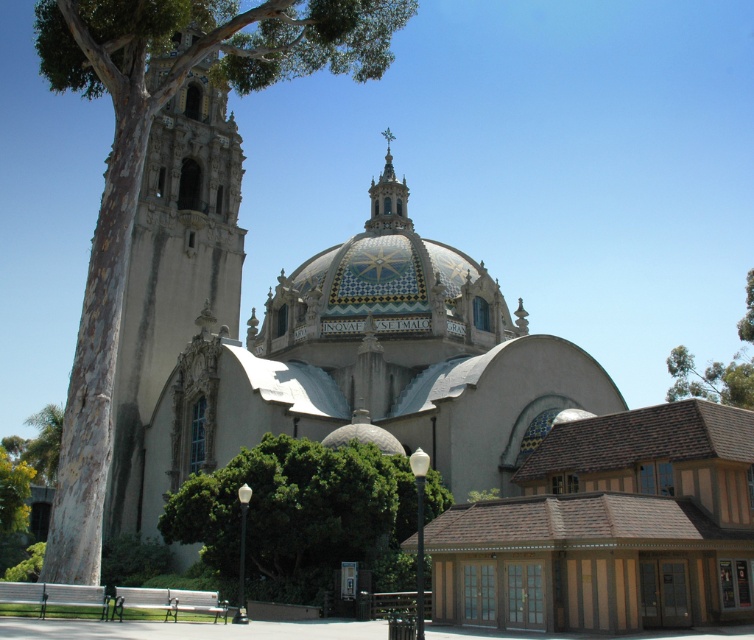
Question: Does green leafy tree at lower center lie behind gold mosaic spire at upper center?

Choices:
 (A) yes
 (B) no

Answer: (B)

Question: Which of the following is the closest to the observer?

Choices:
 (A) pyautogui.click(x=610, y=548)
 (B) pyautogui.click(x=198, y=52)
 (C) pyautogui.click(x=179, y=524)

Answer: (A)

Question: Based on their relative distances, which object is nearer to the brown wooden building at lower right?

Choices:
 (A) green leafy tree at upper right
 (B) gold mosaic spire at upper center
 (C) green leafy tree at lower center

Answer: (C)

Question: Is brown wooden building at lower right bigger than gold mosaic spire at upper center?

Choices:
 (A) yes
 (B) no

Answer: (A)

Question: Is the position of brown wooden building at lower right more distant than that of smooth bark tree at left?

Choices:
 (A) no
 (B) yes

Answer: (B)

Question: Which point appears closest to the camera in this image?

Choices:
 (A) (329, 540)
 (B) (189, 42)
 (C) (685, 385)

Answer: (A)